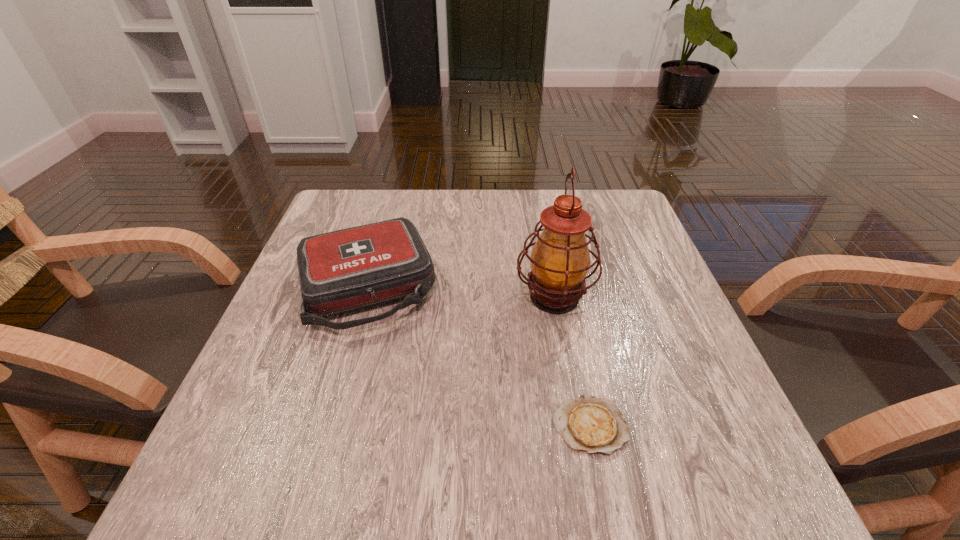
This screenshot has height=540, width=960. I want to click on the tallest object, so click(560, 259).

Locate an element on the screen. the first-aid kit is located at coordinates (358, 267).

I want to click on the leftmost object, so click(x=358, y=267).

This screenshot has height=540, width=960. I want to click on quiche, so click(589, 424).

Identify the location of the nearest object. (589, 424).

The image size is (960, 540). Identify the location of free spot located on the back of the oil lamp. (536, 193).

You are a GUI agent. You are given a task and a screenshot of the screen. Output one action in this format:
    pyautogui.click(x=<x>, y=<y>)
    Task: Click on the vacant region located on the front of the first-aid kit
    
    Given the screenshot: What is the action you would take?
    pyautogui.click(x=321, y=450)

Identify the location of free point located on the left of the quiche. (403, 426).

The width and height of the screenshot is (960, 540). What are the coordinates of `object at the near edge` in the screenshot? It's located at (589, 424).

Where is `object situated at the left edge`? object situated at the left edge is located at coordinates (358, 267).